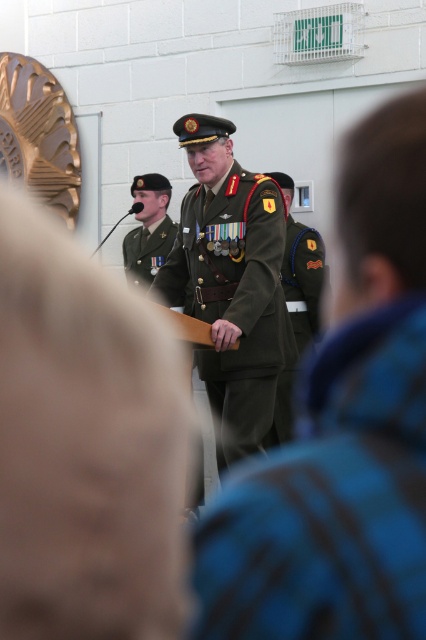
Question: Is olive green fabric uniform at center below green fabric uniform at center?

Choices:
 (A) no
 (B) yes

Answer: (B)

Question: Does green fabric uniform at center appear on the left side of olive green uniform at center?

Choices:
 (A) no
 (B) yes

Answer: (A)

Question: Which object is farther from the camera taking this photo?

Choices:
 (A) olive green fabric uniform at center
 (B) green matte uniform at center
 (C) green fabric uniform at center

Answer: (C)

Question: Among these points, which one is nearest to the camera?

Choices:
 (A) (296, 257)
 (B) (416, 385)

Answer: (B)

Question: Which point is closer to the camera taking this photo?

Choices:
 (A) (138, 282)
 (B) (317, 273)
 (C) (247, 316)
 (D) (311, 534)

Answer: (D)

Question: Can you confirm if green matte uniform at center is positioned to the left of green fabric uniform at center?

Choices:
 (A) yes
 (B) no

Answer: (A)